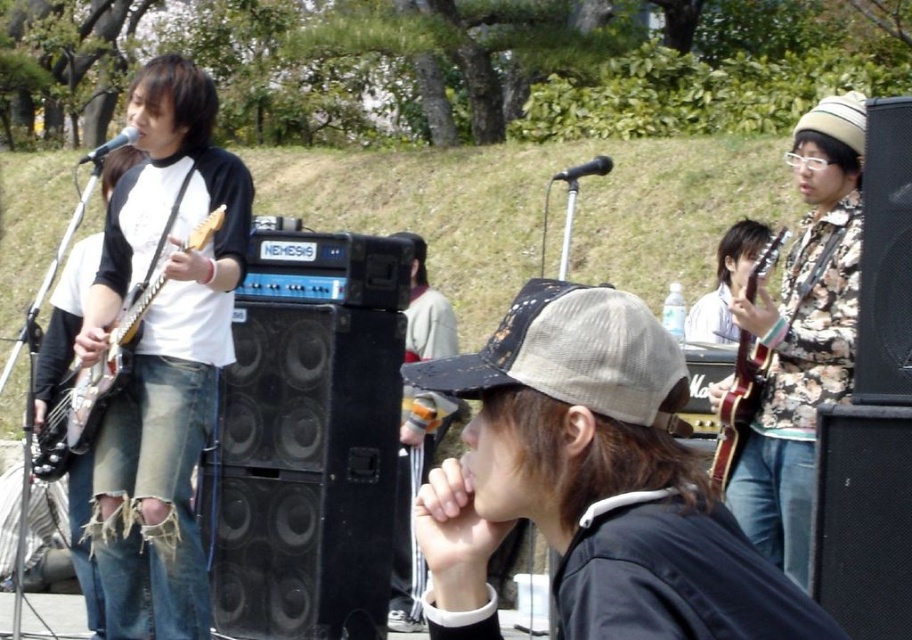
You are a photographer trying to capture a closeup shot of the matte white electric guitar at left without including the ripped denim jeans at left in the frame. Given their sizes, is this feasible?

The ripped denim jeans at left is wider than the matte white electric guitar at left. Since the jeans are wider, it might be challenging to frame the guitar without including the jeans if they are positioned closely together. Adjusting the camera angle or moving closer to the guitar could help isolate it.